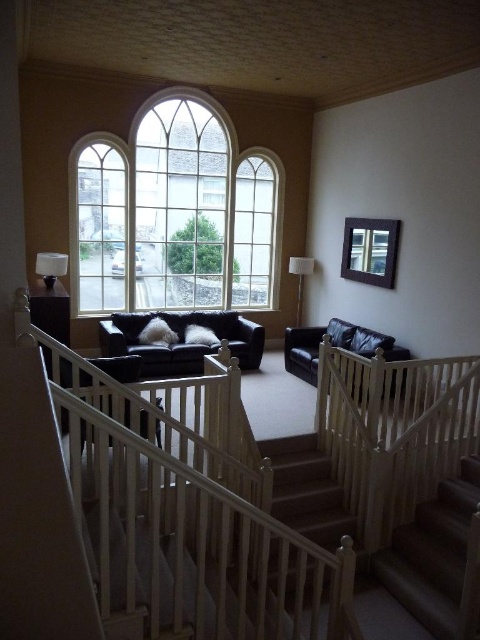
You are standing at the entrance of the room and want to move towards the two points marked in the image. Which point, point (173, 202) or point (278, 492), will you reach first?

You will reach point (173, 202) first because it is closer to you than point (278, 492), which is further away.

You are a delivery person trying to place a package between the matte black couch at center and the matte white lamp at center. The package measures 1.5 meters in length. Can you fit the package between them without moving either object?

The distance between the matte black couch at center and the matte white lamp at center is 2.09 meters. Since the package is 1.5 meters long, there is enough space to fit it between them without moving either object.